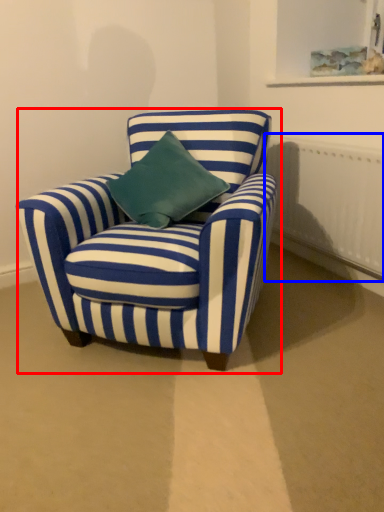
Question: Which point is further to the camera, chair (highlighted by a red box) or radiator (highlighted by a blue box)?

Choices:
 (A) chair
 (B) radiator

Answer: (B)